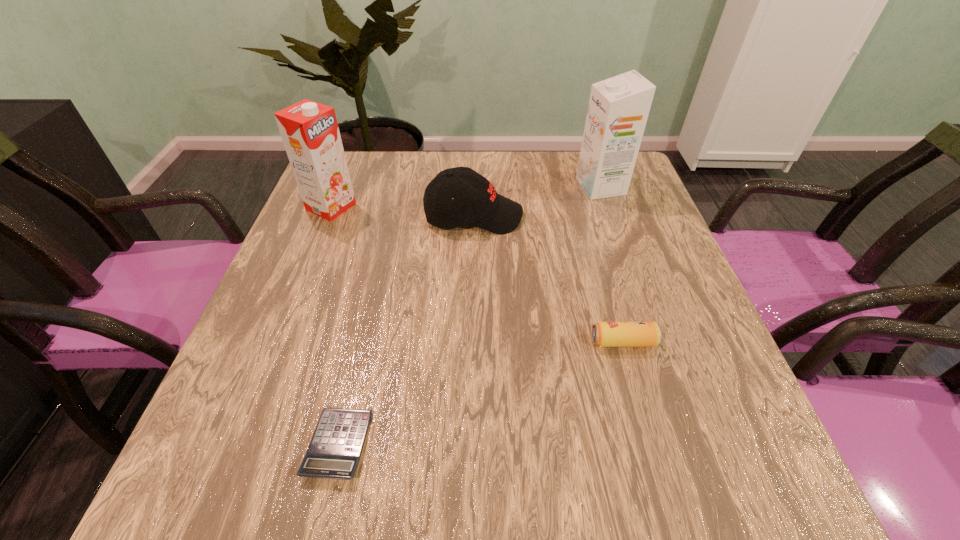
The height and width of the screenshot is (540, 960). I want to click on blank space at the far edge of the desktop, so click(497, 166).

In the image, there is a desktop. At what (x,y) coordinates should I click in order to perform the action: click on vacant space at the near edge. Please return your answer as a coordinate pair (x, y). The width and height of the screenshot is (960, 540). Looking at the image, I should click on (613, 498).

I want to click on vacant space at the left edge, so click(x=340, y=263).

Where is `vacant area at the right edge of the desktop`? vacant area at the right edge of the desktop is located at coordinates (692, 443).

This screenshot has width=960, height=540. Identify the location of vacant region between the third tallest object and the fourth farthest object. (548, 279).

Image resolution: width=960 pixels, height=540 pixels. I want to click on vacant region between the fourth farthest object and the nearest object, so click(x=481, y=393).

Identify the location of empty location between the third tallest object and the right carton. (538, 201).

Identify the location of vacant area that lies between the baseball cap and the right carton. (538, 201).

Where is `free space between the calculator and the right carton`? free space between the calculator and the right carton is located at coordinates (469, 315).

Find the location of a particular element. The width and height of the screenshot is (960, 540). vacant space that is in between the third tallest object and the beer can is located at coordinates (548, 279).